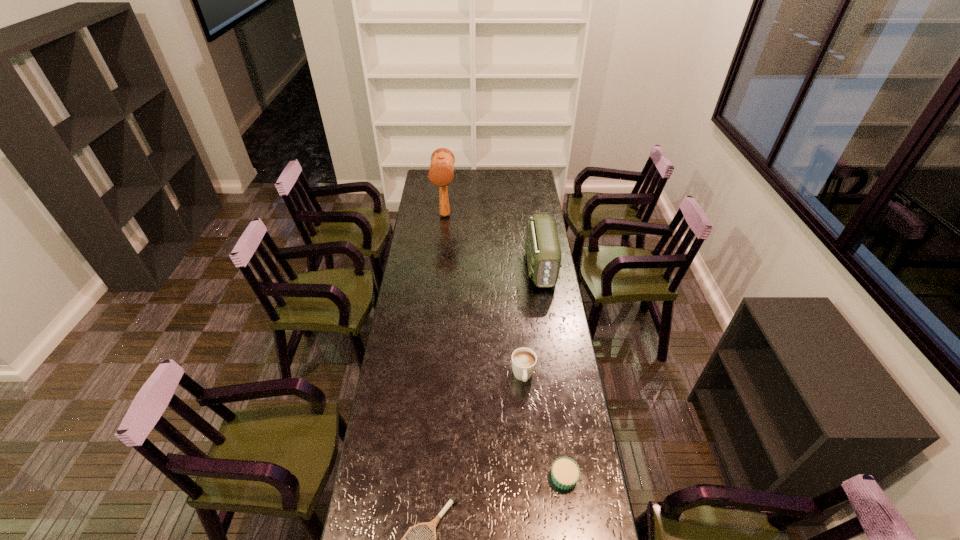
Image resolution: width=960 pixels, height=540 pixels. What are the coordinates of `mallet` in the screenshot? It's located at (441, 170).

This screenshot has height=540, width=960. Find the location of `the farthest object`. the farthest object is located at coordinates (441, 170).

Locate an element on the screen. radio_receiver is located at coordinates (542, 246).

The height and width of the screenshot is (540, 960). Identify the location of the second farthest object. (542, 246).

In order to click on cappuccino in this screenshot , I will do `click(524, 360)`.

Identify the location of the third tallest object. (524, 360).

I want to click on the second shortest object, so click(565, 473).

Where is `cupcake`? cupcake is located at coordinates (565, 473).

At what (x,y) coordinates should I click in order to perform the action: click on vacant point located on the strike surface of the farthest object. Please return your answer as a coordinate pair (x, y). Looking at the image, I should click on (442, 252).

This screenshot has height=540, width=960. In order to click on free spot located on the front-facing side of the radio_receiver in this screenshot , I will do `click(546, 307)`.